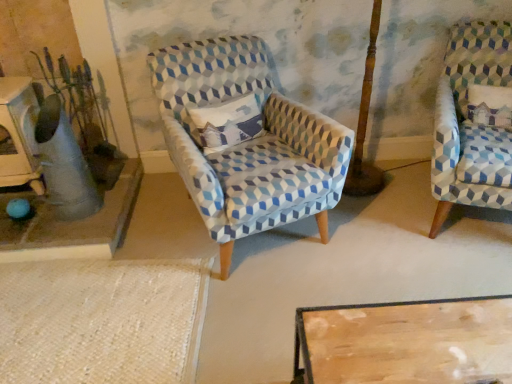
Measure the distance between blue-patterned fabric chair at right, which is counted as the 2th chair, starting from the left, and camera.

The depth of blue-patterned fabric chair at right, which is counted as the 2th chair, starting from the left, is 1.85 meters.

Measure the distance between point (288, 197) and camera.

A distance of 5.83 feet exists between point (288, 197) and camera.

Find the location of a particular element. The width and height of the screenshot is (512, 384). matte gray vase at left is located at coordinates (80, 102).

Identify the location of blue-patterned fabric chair at right, positioned as the first chair in right-to-left order. The width and height of the screenshot is (512, 384). (474, 121).

From the picture: Which of these two, matte gray concrete table at left or matte gray vase at left, is wider?

With larger width is matte gray concrete table at left.

Can you confirm if matte gray concrete table at left is smaller than matte gray vase at left?

Actually, matte gray concrete table at left might be larger than matte gray vase at left.

Consider the image. Can you confirm if matte gray concrete table at left is taller than matte gray vase at left?

No.

Is matte gray concrete table at left inside or outside of matte gray vase at left?

matte gray concrete table at left exists outside the volume of matte gray vase at left.

Locate an element on the screen. chair on the left of blue-patterned fabric chair at right, positioned as the first chair in right-to-left order is located at coordinates (246, 141).

Is blue patterned fabric chair at center, acting as the 1th chair starting from the left, completely or partially outside of blue-patterned fabric chair at right, which is counted as the 2th chair, starting from the left?

Yes.

Based on their positions, is blue patterned fabric chair at center, the 2th chair positioned from the right, located to the left or right of blue-patterned fabric chair at right, which is counted as the 2th chair, starting from the left?

Based on their positions, blue patterned fabric chair at center, the 2th chair positioned from the right, is located to the left of blue-patterned fabric chair at right, which is counted as the 2th chair, starting from the left.

Is blue patterned fabric chair at center, the 2th chair positioned from the right, thinner than blue-patterned fabric chair at right, positioned as the first chair in right-to-left order?

No.

From the picture: Considering the relative sizes of matte gray vase at left and blue-patterned fabric chair at right, positioned as the first chair in right-to-left order, in the image provided, is matte gray vase at left thinner than blue-patterned fabric chair at right, positioned as the first chair in right-to-left order,?

Correct, the width of matte gray vase at left is less than that of blue-patterned fabric chair at right, positioned as the first chair in right-to-left order.

From the image's perspective, which one is positioned lower, matte gray vase at left or blue-patterned fabric chair at right, which is counted as the 2th chair, starting from the left?

blue-patterned fabric chair at right, which is counted as the 2th chair, starting from the left, from the image's perspective.

From a real-world perspective, between matte gray vase at left and blue-patterned fabric chair at right, which is counted as the 2th chair, starting from the left, who is vertically lower?

From a 3D spatial view, blue-patterned fabric chair at right, which is counted as the 2th chair, starting from the left, is below.

In the scene shown: From the image's perspective, does matte gray vase at left appear lower than blue patterned fabric chair at center, acting as the 1th chair starting from the left?

Actually, matte gray vase at left appears above blue patterned fabric chair at center, acting as the 1th chair starting from the left, in the image.

Looking at this image, from a real-world perspective, which object rests below the other?

blue patterned fabric chair at center, acting as the 1th chair starting from the left, from a real-world perspective.

Which object is closer to the camera, matte gray vase at left or blue patterned fabric chair at center, acting as the 1th chair starting from the left?

blue patterned fabric chair at center, acting as the 1th chair starting from the left, is closer to the camera.

Would you say blue patterned fabric chair at center, the 2th chair positioned from the right, is part of matte gray vase at left's contents?

That's incorrect, blue patterned fabric chair at center, the 2th chair positioned from the right, is not inside matte gray vase at left.

From the image's perspective, is blue patterned fabric chair at center, the 2th chair positioned from the right, under matte gray concrete table at left?

Actually, blue patterned fabric chair at center, the 2th chair positioned from the right, appears above matte gray concrete table at left in the image.

Is point (225, 93) closer to viewer compared to point (105, 234)?

No, it is not.

Is blue patterned fabric chair at center, the 2th chair positioned from the right, facing towards matte gray concrete table at left?

No.

Based on their sizes in the image, would you say blue patterned fabric chair at center, acting as the 1th chair starting from the left, is bigger or smaller than matte gray concrete table at left?

Considering their sizes, blue patterned fabric chair at center, acting as the 1th chair starting from the left, takes up more space than matte gray concrete table at left.

From the image's perspective, which is below, blue-patterned fabric chair at right, which is counted as the 2th chair, starting from the left, or matte gray concrete table at left?

From the image's view, matte gray concrete table at left is below.

Image resolution: width=512 pixels, height=384 pixels. Identify the location of the 1st chair in front of the matte gray concrete table at left. (474, 121).

Is blue-patterned fabric chair at right, positioned as the first chair in right-to-left order, taller or shorter than matte gray concrete table at left?

blue-patterned fabric chair at right, positioned as the first chair in right-to-left order, is taller than matte gray concrete table at left.

Is blue patterned fabric chair at center, the 2th chair positioned from the right, outside of matte gray vase at left?

That's correct, blue patterned fabric chair at center, the 2th chair positioned from the right, is outside of matte gray vase at left.

Is blue patterned fabric chair at center, acting as the 1th chair starting from the left, turned away from matte gray vase at left?

That's not correct — blue patterned fabric chair at center, acting as the 1th chair starting from the left, is not looking away from matte gray vase at left.

The height and width of the screenshot is (384, 512). Identify the location of plant that appears on the left of blue patterned fabric chair at center, acting as the 1th chair starting from the left. (80, 102).

From the image's perspective, does blue patterned fabric chair at center, acting as the 1th chair starting from the left, appear higher than matte gray vase at left?

No, from the image's perspective, blue patterned fabric chair at center, acting as the 1th chair starting from the left, is not on top of matte gray vase at left.

You are a GUI agent. You are given a task and a screenshot of the screen. Output one action in this format:
    pyautogui.click(x=<x>, y=<y>)
    Task: Click on the plant in front of the matte gray concrete table at left
    The height and width of the screenshot is (384, 512).
    Given the screenshot: What is the action you would take?
    pyautogui.click(x=80, y=102)

This screenshot has width=512, height=384. What are the coordinates of `chair on the left of blue-patterned fabric chair at right, positioned as the first chair in right-to-left order` in the screenshot? It's located at (246, 141).

Based on their spatial positions, is blue patterned fabric chair at center, the 2th chair positioned from the right, or matte gray vase at left further from matte gray concrete table at left?

blue patterned fabric chair at center, the 2th chair positioned from the right, is positioned further to the anchor matte gray concrete table at left.

Looking at the image, which one is located further to blue-patterned fabric chair at right, which is counted as the 2th chair, starting from the left, matte gray concrete table at left or matte gray vase at left?

Among the two, matte gray vase at left is located further to blue-patterned fabric chair at right, which is counted as the 2th chair, starting from the left.

From the image, which object appears to be nearer to matte gray vase at left, blue patterned fabric chair at center, acting as the 1th chair starting from the left, or blue-patterned fabric chair at right, positioned as the first chair in right-to-left order?

Among the two, blue patterned fabric chair at center, acting as the 1th chair starting from the left, is located nearer to matte gray vase at left.

In the scene shown: From the image, which object appears to be nearer to blue-patterned fabric chair at right, positioned as the first chair in right-to-left order, blue patterned fabric chair at center, acting as the 1th chair starting from the left, or matte gray concrete table at left?

blue patterned fabric chair at center, acting as the 1th chair starting from the left.

Estimate the real-world distances between objects in this image. Which object is further from matte gray vase at left, matte gray concrete table at left or blue-patterned fabric chair at right, which is counted as the 2th chair, starting from the left?

blue-patterned fabric chair at right, which is counted as the 2th chair, starting from the left, is further to matte gray vase at left.

Based on their spatial positions, is matte gray vase at left or matte gray concrete table at left closer to blue-patterned fabric chair at right, positioned as the first chair in right-to-left order?

matte gray concrete table at left.

When comparing their distances from blue patterned fabric chair at center, acting as the 1th chair starting from the left, does matte gray concrete table at left or blue-patterned fabric chair at right, positioned as the first chair in right-to-left order, seem further?

Among the two, blue-patterned fabric chair at right, positioned as the first chair in right-to-left order, is located further to blue patterned fabric chair at center, acting as the 1th chair starting from the left.

Considering their positions, is matte gray concrete table at left positioned further to blue-patterned fabric chair at right, which is counted as the 2th chair, starting from the left, than blue patterned fabric chair at center, the 2th chair positioned from the right?

Among the two, matte gray concrete table at left is located further to blue-patterned fabric chair at right, which is counted as the 2th chair, starting from the left.

I want to click on plant between matte gray concrete table at left and blue-patterned fabric chair at right, positioned as the first chair in right-to-left order, so click(80, 102).

The height and width of the screenshot is (384, 512). In order to click on chair between matte gray vase at left and blue-patterned fabric chair at right, which is counted as the 2th chair, starting from the left in this screenshot , I will do `click(246, 141)`.

At what (x,y) coordinates should I click in order to perform the action: click on plant between matte gray concrete table at left and blue patterned fabric chair at center, acting as the 1th chair starting from the left, from left to right. Please return your answer as a coordinate pair (x, y). Image resolution: width=512 pixels, height=384 pixels. Looking at the image, I should click on (80, 102).

This screenshot has width=512, height=384. Find the location of `chair between matte gray concrete table at left and blue-patterned fabric chair at right, positioned as the first chair in right-to-left order, in the horizontal direction`. chair between matte gray concrete table at left and blue-patterned fabric chair at right, positioned as the first chair in right-to-left order, in the horizontal direction is located at coordinates (246, 141).